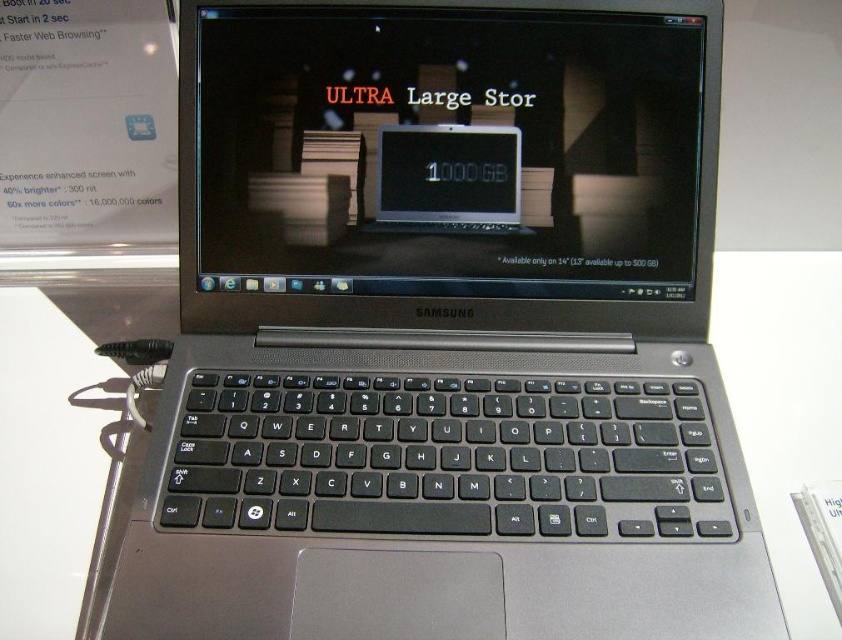
Question: Which point is closer to the camera?

Choices:
 (A) (517, 189)
 (B) (425, 180)

Answer: (B)

Question: From the image, what is the correct spatial relationship of satin black laptop at center in relation to black glossy screen at center?

Choices:
 (A) right
 (B) left

Answer: (B)

Question: Does satin black laptop at center come in front of black glossy screen at center?

Choices:
 (A) yes
 (B) no

Answer: (A)

Question: Which point appears farthest from the camera in this image?

Choices:
 (A) (496, 205)
 (B) (302, 157)

Answer: (A)

Question: Which point is closer to the camera?

Choices:
 (A) satin black laptop at center
 (B) black glossy screen at center

Answer: (A)

Question: Does satin black laptop at center lie in front of black glossy screen at center?

Choices:
 (A) no
 (B) yes

Answer: (B)